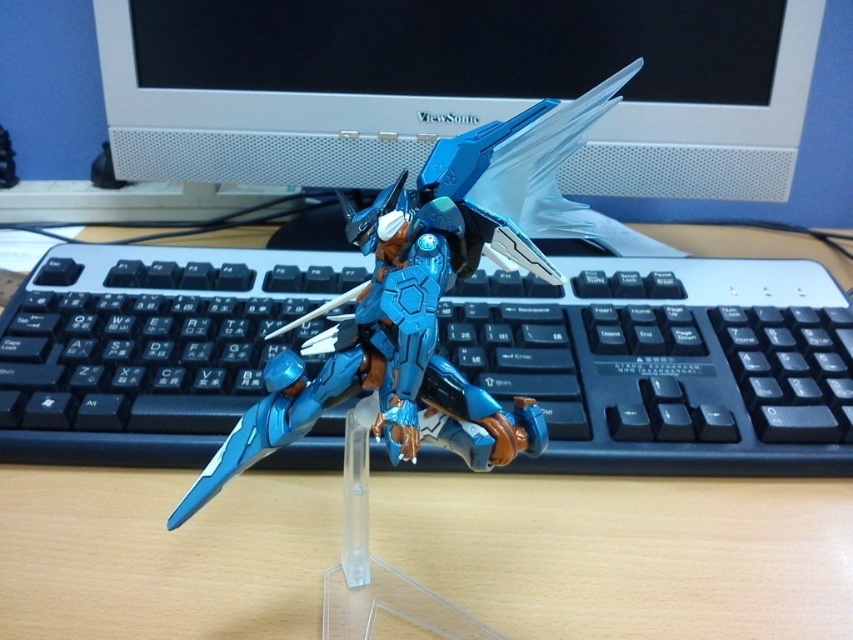
Is white plastic monitor at upper center taller than metallic blue robot at center?

Incorrect, white plastic monitor at upper center's height is not larger of metallic blue robot at center's.

What do you see at coordinates (456, 88) in the screenshot? I see `white plastic monitor at upper center` at bounding box center [456, 88].

Where is `white plastic monitor at upper center`? The image size is (853, 640). white plastic monitor at upper center is located at coordinates pos(456,88).

Which of these two, wooden table at center or white plastic monitor at upper center, stands taller?

white plastic monitor at upper center

Does wooden table at center come in front of white plastic monitor at upper center?

Yes, wooden table at center is in front of white plastic monitor at upper center.

Does point (730, 576) lie behind point (654, 163)?

No, (730, 576) is in front of (654, 163).

The image size is (853, 640). Identify the location of wooden table at center. (627, 554).

In the scene shown: Does wooden table at center have a lesser width compared to metallic blue robot at center?

No, wooden table at center is not thinner than metallic blue robot at center.

Does wooden table at center appear on the right side of metallic blue robot at center?

Indeed, wooden table at center is positioned on the right side of metallic blue robot at center.

The image size is (853, 640). What do you see at coordinates (627, 554) in the screenshot? I see `wooden table at center` at bounding box center [627, 554].

Identify the location of wooden table at center. This screenshot has width=853, height=640. (627, 554).